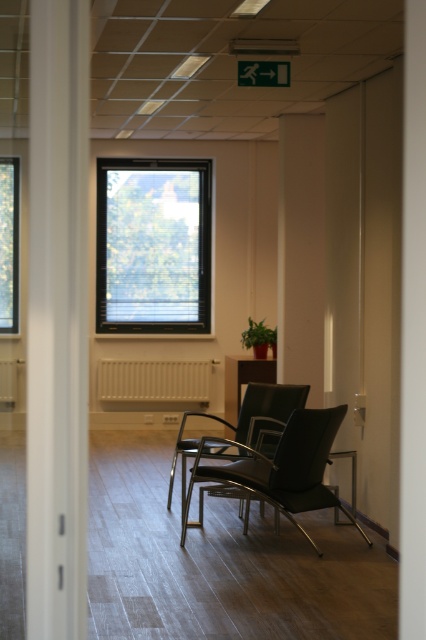
Question: Which point is farther to the camera?

Choices:
 (A) beige matte radiator at center
 (B) black leather armchair at center
 (C) white matte radiator at center
 (D) matte black chair at center

Answer: (A)

Question: Which point is farther from the camera taking this photo?

Choices:
 (A) (236, 394)
 (B) (152, 227)
 (C) (5, 262)

Answer: (B)

Question: Is transparent glass window at center to the right of white matte radiator at center from the viewer's perspective?

Choices:
 (A) no
 (B) yes

Answer: (B)

Question: Which point is farther from the camera taking this photo?

Choices:
 (A) (167, 358)
 (B) (5, 285)
 (C) (2, 374)

Answer: (A)

Question: Can you confirm if black leather armchair at center is bigger than matte black armchair at center?

Choices:
 (A) yes
 (B) no

Answer: (B)

Question: Where is black leather armchair at center located in relation to matte black armchair at center in the image?

Choices:
 (A) right
 (B) left

Answer: (A)